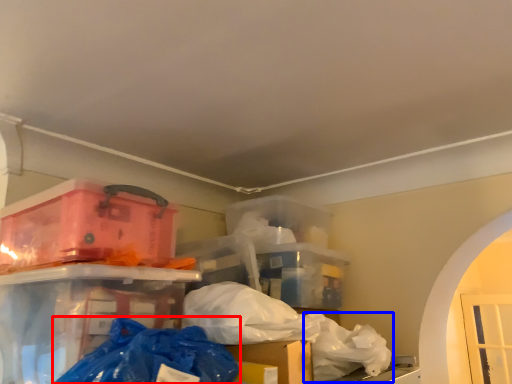
Question: Which object appears closest to the camera in this image, plastic bag (highlighted by a red box) or plastic bag (highlighted by a blue box)?

Choices:
 (A) plastic bag
 (B) plastic bag

Answer: (A)